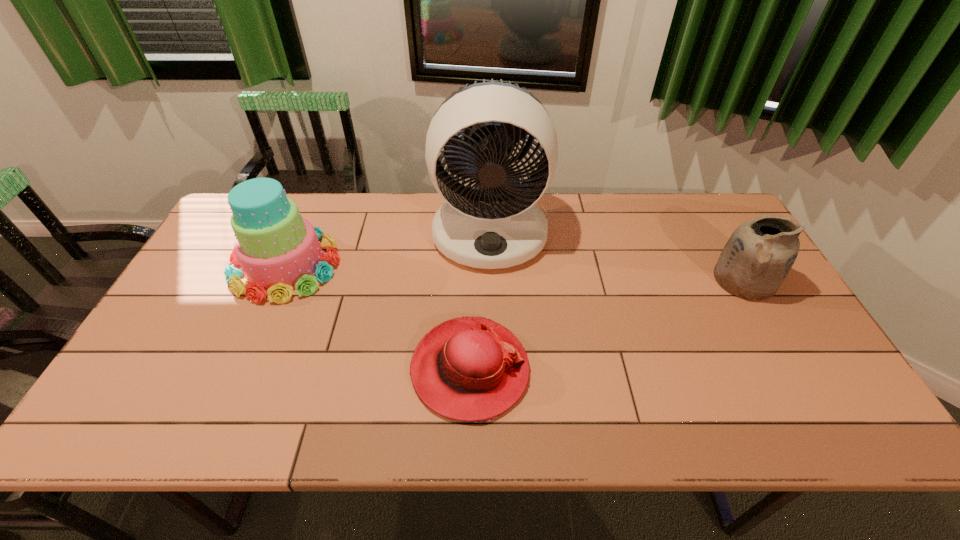
The image size is (960, 540). Find the location of `fan`. fan is located at coordinates (497, 224).

Find the location of a particular element. the leftmost object is located at coordinates (279, 251).

Locate an element on the screen. Image resolution: width=960 pixels, height=540 pixels. the third shortest object is located at coordinates (279, 251).

Identify the location of the second shortest object. The height and width of the screenshot is (540, 960). (758, 256).

Identify the location of pottery. (758, 256).

Identify the location of the nearest object. (472, 369).

Where is `hat`? This screenshot has height=540, width=960. hat is located at coordinates (472, 369).

The image size is (960, 540). In order to click on free region located on the grille of the tallest object in this screenshot , I will do `click(492, 292)`.

You are a GUI agent. You are given a task and a screenshot of the screen. Output one action in this format:
    pyautogui.click(x=<x>, y=<y>)
    Task: Click on the vacant space situated 0.200m on the right of the cake
    
    Given the screenshot: What is the action you would take?
    pyautogui.click(x=406, y=267)

This screenshot has width=960, height=540. Identify the location of free space located on the back of the rightmost object. (698, 201).